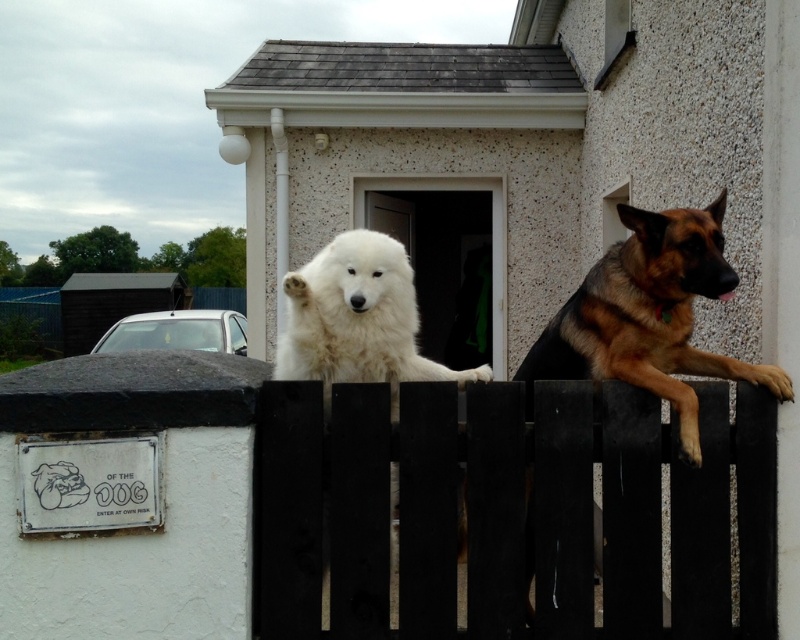
In the scene shown: You are standing in front of the house where the two dogs are sitting on the black wooden fence. You notice two points marked on the scene. The first point is at coordinate point (606, 285) and the second point is at coordinate point (304, 362). If you want to throw a treat to the point closer to you, which point should you aim for?

Point (304, 362) is closer to you than point (606, 285), so you should aim for point (304, 362) to throw the treat.

You are a drone operator trying to capture a photo of the black wooden fence at center. The drone is currently at coordinates 0.5, 0.5. Which direction should you move the drone to reach the fence?

The black wooden fence at center is located at coordinates (509, 509), so you should move the drone to the northeast direction to reach it.